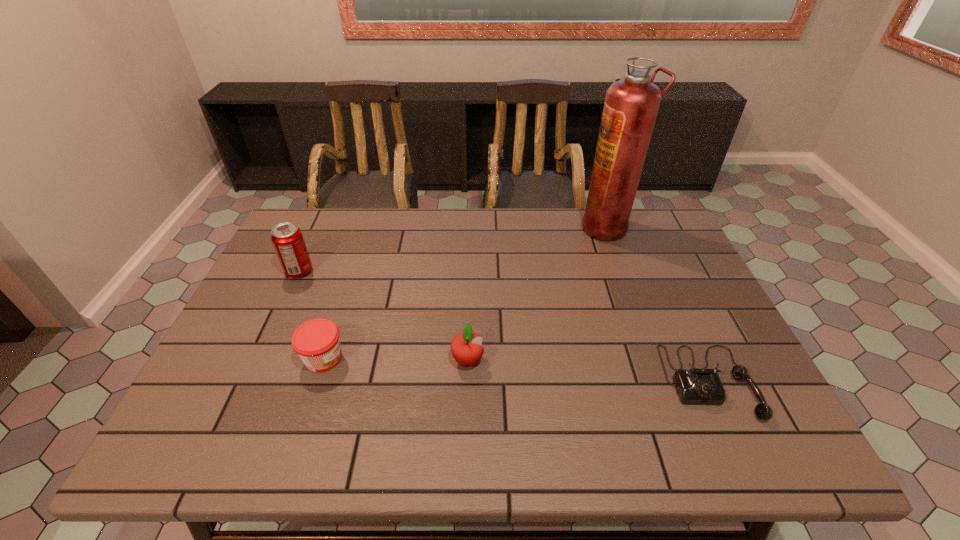
In order to click on the farthest object in this screenshot , I will do `click(631, 105)`.

Image resolution: width=960 pixels, height=540 pixels. I want to click on fire extinguisher, so click(x=631, y=105).

What are the coordinates of `the leftmost object` in the screenshot? It's located at (287, 238).

You are a GUI agent. You are given a task and a screenshot of the screen. Output one action in this format:
    pyautogui.click(x=<x>, y=<y>)
    Task: Click on the second farthest object
    
    Given the screenshot: What is the action you would take?
    pyautogui.click(x=287, y=238)

Identify the location of the third object from right to left. The height and width of the screenshot is (540, 960). (466, 348).

Where is `the fourth object from right to left`? The width and height of the screenshot is (960, 540). the fourth object from right to left is located at coordinates (317, 342).

This screenshot has height=540, width=960. I want to click on telephone, so click(x=703, y=386).

Locate an element on the screen. free space located on the side of the fire extinguisher with the label is located at coordinates (522, 227).

Where is `vacant space located 0.300m on the side of the fire extinguisher with the label`? Image resolution: width=960 pixels, height=540 pixels. vacant space located 0.300m on the side of the fire extinguisher with the label is located at coordinates (489, 227).

Where is `free space located 0.380m on the side of the fire extinguisher with the label`? Image resolution: width=960 pixels, height=540 pixels. free space located 0.380m on the side of the fire extinguisher with the label is located at coordinates (465, 227).